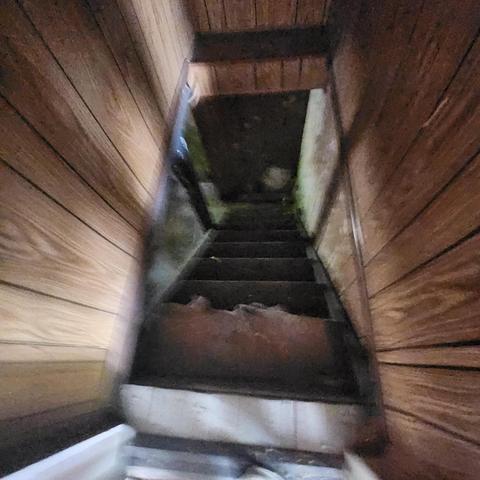
In order to click on second stair case in this screenshot , I will do coord(268,262).